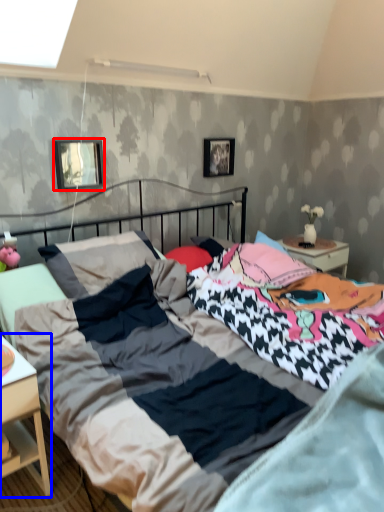
Question: Which point is further to the camera, picture frame (highlighted by a red box) or nightstand (highlighted by a blue box)?

Choices:
 (A) picture frame
 (B) nightstand

Answer: (A)